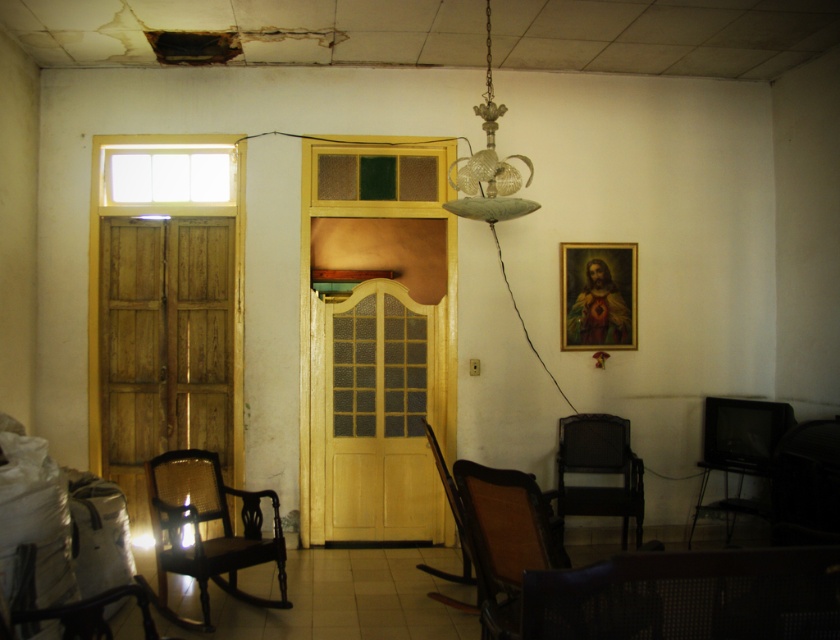
Question: Is wooden door at left smaller than gold-framed portrait at upper right?

Choices:
 (A) no
 (B) yes

Answer: (A)

Question: Which object appears closest to the camera in this image?

Choices:
 (A) dark brown woven armchair at center
 (B) dark brown woven chair at lower right

Answer: (B)

Question: Does wooden door at left have a larger size compared to woven brown armchair at lower right?

Choices:
 (A) yes
 (B) no

Answer: (B)

Question: Which point is closer to the camera?

Choices:
 (A) dark brown woven chair at lower right
 (B) dark brown woven armchair at center
 (C) wooden door at left
 (D) woven brown armchair at lower right

Answer: (A)

Question: Where is wooden door at center located in relation to woven brown armchair at lower right in the image?

Choices:
 (A) above
 (B) below

Answer: (A)

Question: Based on their relative distances, which object is farther from the gold-framed portrait at upper right?

Choices:
 (A) dark brown woven chair at lower right
 (B) wooden door at center

Answer: (A)